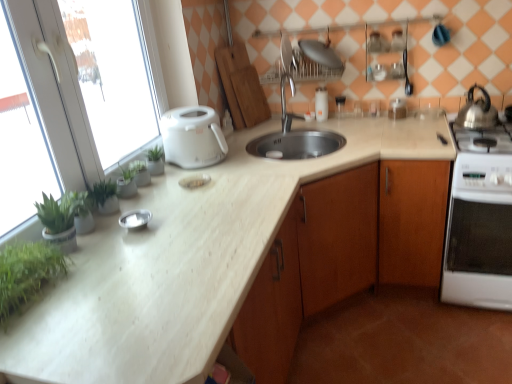
Identify the location of free spot in front of clear glass jar at upper right, which is the 4th appliance in left-to-right order. This screenshot has height=384, width=512. (407, 120).